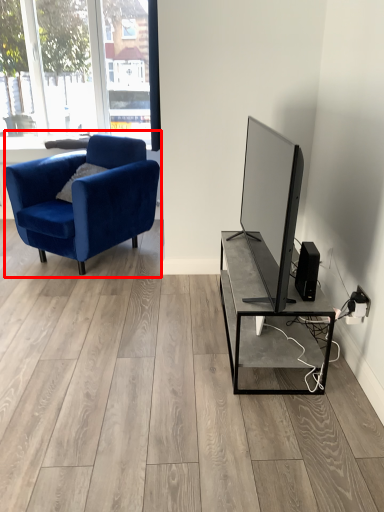
Question: Where is chair (annotated by the red box) located in relation to speaker in the image?

Choices:
 (A) right
 (B) left

Answer: (B)